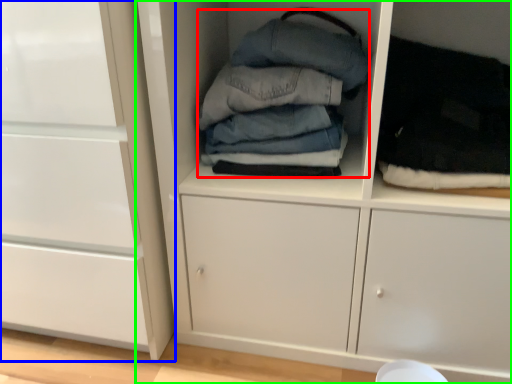
Question: Which object is the farthest from clothing (highlighted by a red box)? Choose among these: cabinetry (highlighted by a blue box) or cupboard (highlighted by a green box).

Choices:
 (A) cabinetry
 (B) cupboard

Answer: (A)